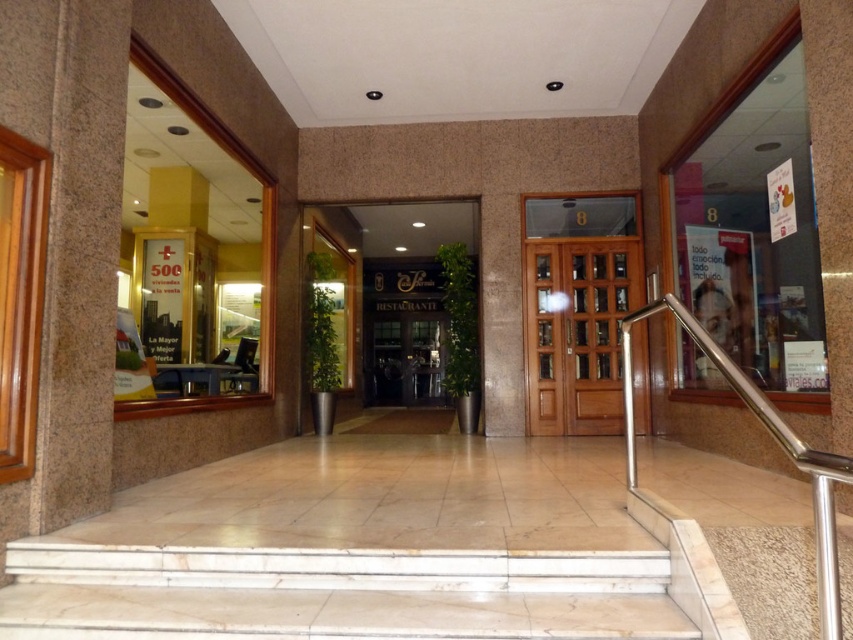
You are standing at the entrance of the building and need to locate the granite pillar at left and the mahogany wood door at center. From your perspective, which object is positioned to the left of the other?

The granite pillar at left is to the left of the mahogany wood door at center, so the granite pillar at left is positioned to the left of the mahogany wood door at center.

You are a delivery person carrying a large package that requires passing through the entrance. The package is too wide to fit through a narrow space. Which object between the granite pillar at left and the mahogany wood door at center should you avoid to ensure the package can pass through?

The granite pillar at left has a smaller size compared to the mahogany wood door at center, so you should avoid the granite pillar at left because it is narrower and may not allow the large package to pass through. The mahogany wood door at center is larger and more suitable for passing through with the package.